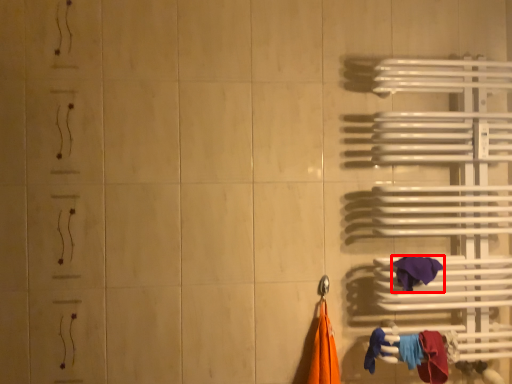
Question: In this image, where is towel (annotated by the red box) located relative to towel?

Choices:
 (A) right
 (B) left

Answer: (B)